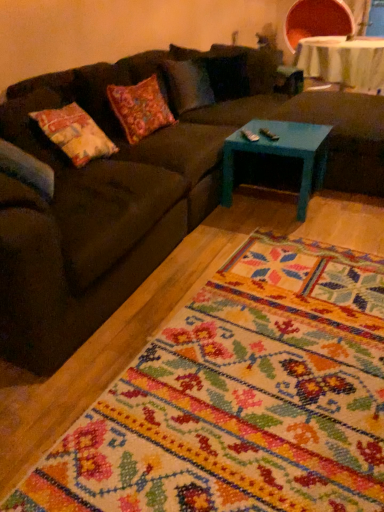
Question: From a real-world perspective, is teal painted wood footrest at center under teal painted wood coffee table at center?

Choices:
 (A) yes
 (B) no

Answer: (B)

Question: Considering the relative sizes of teal painted wood footrest at center and teal painted wood coffee table at center in the image provided, is teal painted wood footrest at center thinner than teal painted wood coffee table at center?

Choices:
 (A) yes
 (B) no

Answer: (B)

Question: Is teal painted wood footrest at center wider than teal painted wood coffee table at center?

Choices:
 (A) yes
 (B) no

Answer: (A)

Question: Does teal painted wood footrest at center appear on the left side of teal painted wood coffee table at center?

Choices:
 (A) no
 (B) yes

Answer: (A)

Question: Does teal painted wood footrest at center have a larger size compared to teal painted wood coffee table at center?

Choices:
 (A) yes
 (B) no

Answer: (A)

Question: Is teal painted wood footrest at center oriented away from teal painted wood coffee table at center?

Choices:
 (A) no
 (B) yes

Answer: (A)

Question: Does teal painted wood footrest at center contain dark brown fabric couch at center?

Choices:
 (A) yes
 (B) no

Answer: (B)

Question: Is teal painted wood footrest at center directly adjacent to dark brown fabric couch at center?

Choices:
 (A) no
 (B) yes

Answer: (A)

Question: Can you confirm if teal painted wood footrest at center is bigger than dark brown fabric couch at center?

Choices:
 (A) no
 (B) yes

Answer: (A)

Question: Does teal painted wood footrest at center have a greater height compared to dark brown fabric couch at center?

Choices:
 (A) yes
 (B) no

Answer: (B)

Question: Does teal painted wood footrest at center appear on the right side of dark brown fabric couch at center?

Choices:
 (A) yes
 (B) no

Answer: (A)

Question: Can you confirm if teal painted wood footrest at center is positioned to the left of dark brown fabric couch at center?

Choices:
 (A) yes
 (B) no

Answer: (B)

Question: Does teal painted wood footrest at center come in front of white fabric table at upper right?

Choices:
 (A) no
 (B) yes

Answer: (B)